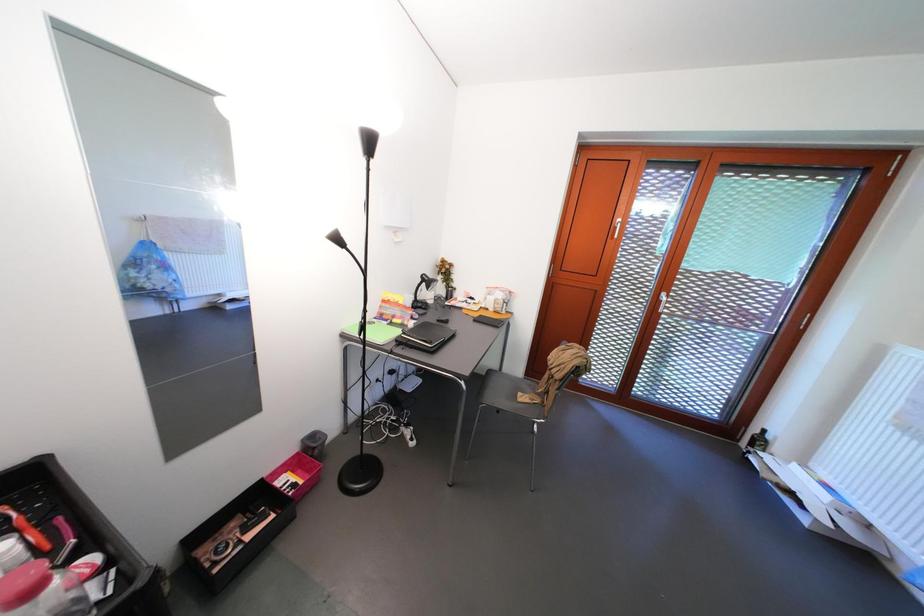
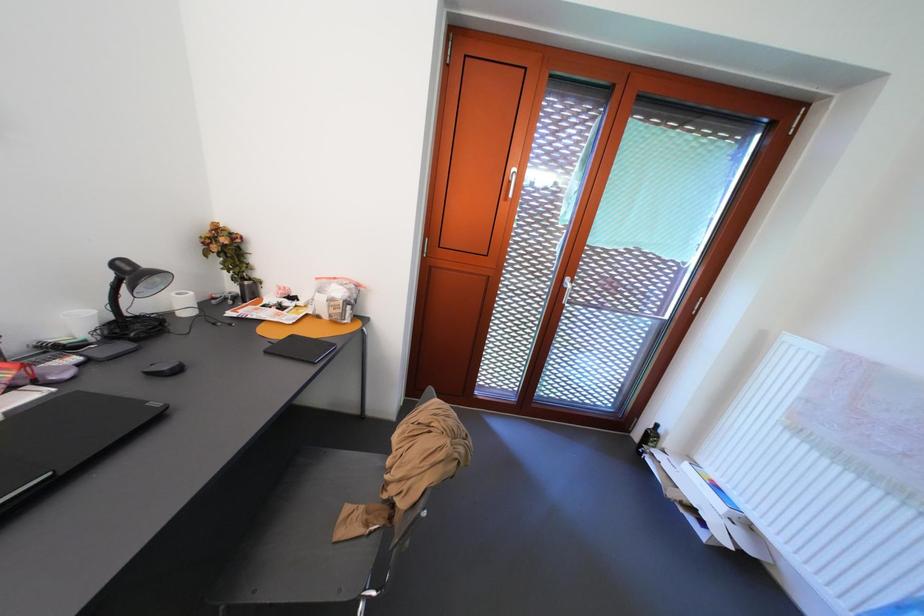
What movement of the cameraman would produce the second image?

The movement direction of the cameraman is right, forward.